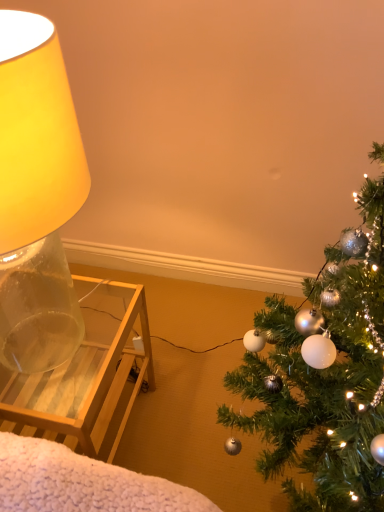
Question: Is shiny silver ornaments at right at the right side of translucent glass lamp at left?

Choices:
 (A) yes
 (B) no

Answer: (A)

Question: Can you confirm if shiny silver ornaments at right is thinner than translucent glass lamp at left?

Choices:
 (A) yes
 (B) no

Answer: (B)

Question: Can you confirm if shiny silver ornaments at right is shorter than translucent glass lamp at left?

Choices:
 (A) no
 (B) yes

Answer: (A)

Question: Can you confirm if shiny silver ornaments at right is bigger than translucent glass lamp at left?

Choices:
 (A) yes
 (B) no

Answer: (B)

Question: From a real-world perspective, is shiny silver ornaments at right on translucent glass lamp at left?

Choices:
 (A) no
 (B) yes

Answer: (A)

Question: Is shiny silver ornaments at right facing towards translucent glass lamp at left?

Choices:
 (A) yes
 (B) no

Answer: (B)

Question: Is translucent glass lamp at left to the right of shiny silver ornaments at right from the viewer's perspective?

Choices:
 (A) yes
 (B) no

Answer: (B)

Question: Is translucent glass lamp at left turned away from shiny silver ornaments at right?

Choices:
 (A) yes
 (B) no

Answer: (B)

Question: Is translucent glass lamp at left positioned behind shiny silver ornaments at right?

Choices:
 (A) no
 (B) yes

Answer: (B)

Question: Is translucent glass lamp at left not inside shiny silver ornaments at right?

Choices:
 (A) no
 (B) yes

Answer: (B)

Question: Is translucent glass lamp at left positioned before shiny silver ornaments at right?

Choices:
 (A) yes
 (B) no

Answer: (B)

Question: From the image's perspective, is translucent glass lamp at left beneath shiny silver ornaments at right?

Choices:
 (A) yes
 (B) no

Answer: (B)

Question: Would you say translucent glass lamp at left is to the left or to the right of shiny silver ornaments at right in the picture?

Choices:
 (A) right
 (B) left

Answer: (B)